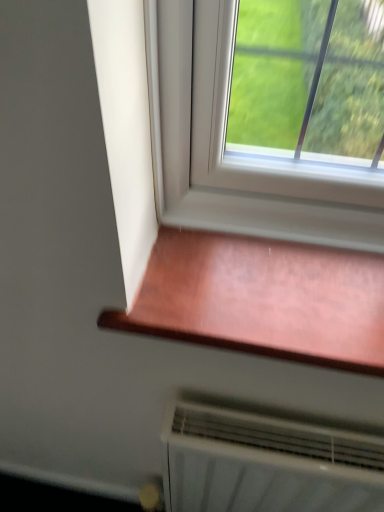
Measure the distance between wooden at lower right and camera.

wooden at lower right is 20.69 inches away from camera.

Describe the element at coordinates (262, 298) in the screenshot. I see `wooden at lower right` at that location.

Find the location of a particular element. This screenshot has width=384, height=512. wooden at lower right is located at coordinates (262, 298).

At what (x,y) coordinates should I click in order to perform the action: click on wooden at lower right. Please return your answer as a coordinate pair (x, y). Looking at the image, I should click on (262, 298).